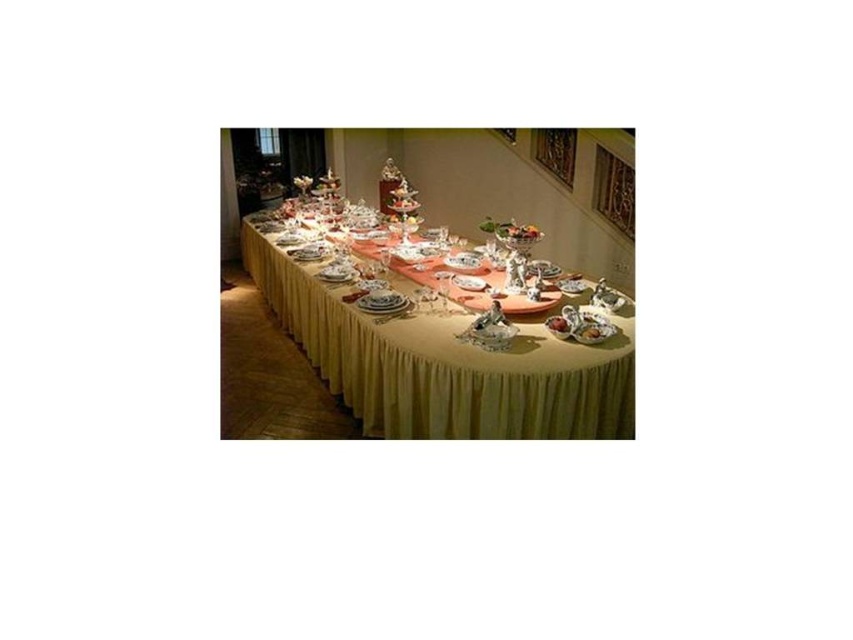
Question: Estimate the real-world distances between objects in this image. Which object is closer to the smooth pink cake at center?

Choices:
 (A) white porcelain plate at center
 (B) yellow fabric tablecloth at center

Answer: (B)

Question: Which of the following is the farthest from the observer?

Choices:
 (A) (606, 332)
 (B) (393, 296)
 (C) (556, 332)

Answer: (B)

Question: Can you confirm if white porcelain plate at center is positioned to the right of smooth pink cake at center?

Choices:
 (A) yes
 (B) no

Answer: (B)

Question: Can you confirm if yellow fabric tablecloth at center is thinner than white porcelain plate at center?

Choices:
 (A) no
 (B) yes

Answer: (A)

Question: Which object appears farthest from the camera in this image?

Choices:
 (A) smooth pink cake at center
 (B) white porcelain plate at center
 (C) yellow fabric tablecloth at center

Answer: (B)

Question: Is yellow fabric tablecloth at center smaller than white porcelain plate at center?

Choices:
 (A) yes
 (B) no

Answer: (B)